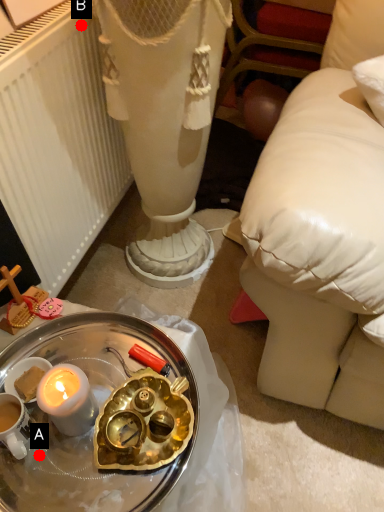
Question: Two points are circled on the image, labeled by A and B beside each circle. Among these points, which one is nearest to the camera?

Choices:
 (A) A is closer
 (B) B is closer

Answer: (A)